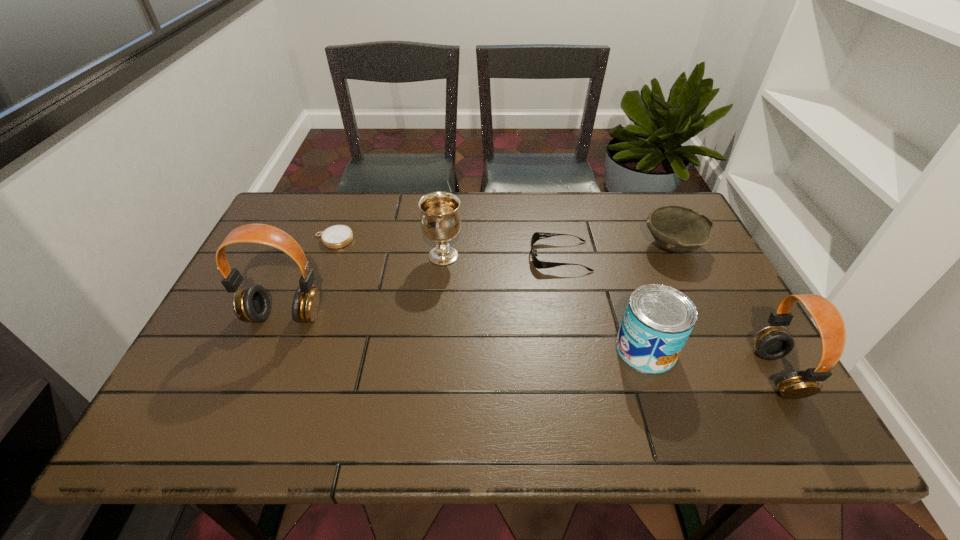
This screenshot has width=960, height=540. Identify the location of the farther headset. [x=252, y=303].

Find the location of a particular element. The width and height of the screenshot is (960, 540). the taller headset is located at coordinates (252, 303).

At what (x,y) coordinates should I click in order to perform the action: click on the right headset. Please return your answer as a coordinate pair (x, y). Looking at the image, I should click on 771,343.

Image resolution: width=960 pixels, height=540 pixels. Identify the location of the shorter headset. (771, 343).

At what (x,y) coordinates should I click in order to perform the action: click on the second shortest object. Please return your answer as a coordinate pair (x, y). The width and height of the screenshot is (960, 540). Looking at the image, I should click on tap(538, 264).

Where is `sunglasses`? sunglasses is located at coordinates (538, 264).

Find the location of a particular element. This screenshot has height=540, width=960. bowl is located at coordinates (679, 229).

I want to click on chalice, so click(x=440, y=219).

Locate an element on the screen. The width and height of the screenshot is (960, 540). the third tallest object is located at coordinates [440, 219].

Where is `the shortest object`? The image size is (960, 540). the shortest object is located at coordinates pyautogui.click(x=338, y=236).